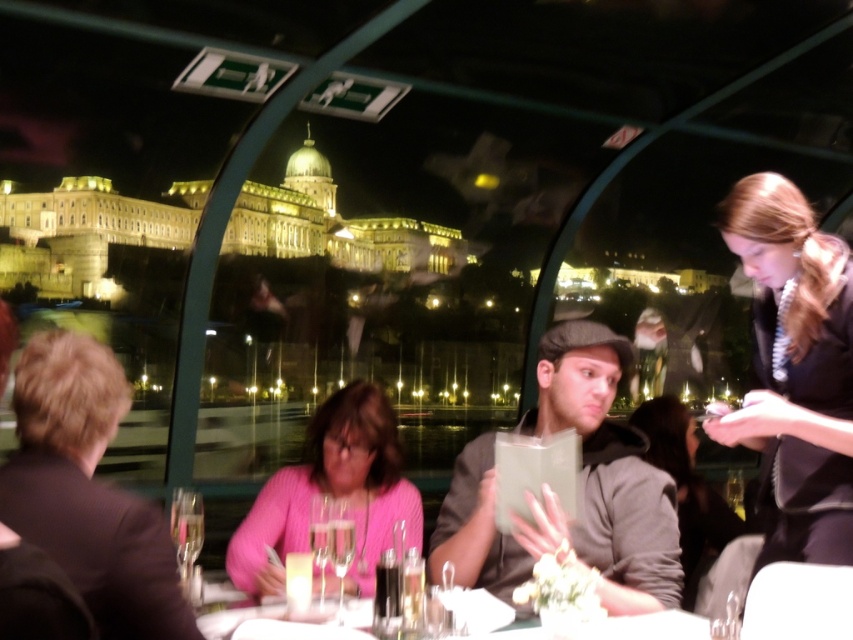
Question: Where is pink knitted sweater at center located in relation to clear glass wine glass at center in the image?

Choices:
 (A) right
 (B) left

Answer: (A)

Question: Which is farther from the clear glass wine glass at lower left?

Choices:
 (A) white glossy table at center
 (B) brown hair at left
 (C) pink knitted sweater at center

Answer: (A)

Question: Considering the real-world distances, which object is farthest from the clear glass wine glass at lower left?

Choices:
 (A) brown hair at left
 (B) white glossy table at center
 (C) matte gray cap at center

Answer: (C)

Question: Considering the relative positions of brown hair at left and white glossy table at center in the image provided, where is brown hair at left located with respect to white glossy table at center?

Choices:
 (A) below
 (B) above

Answer: (B)

Question: Which object is positioned closest to the dark brown hair at right?

Choices:
 (A) brown hair at left
 (B) pink knitted sweater at center
 (C) matte gray cap at center

Answer: (C)

Question: Can you confirm if matte gray cap at center is bigger than clear glass wine glass at center?

Choices:
 (A) no
 (B) yes

Answer: (B)